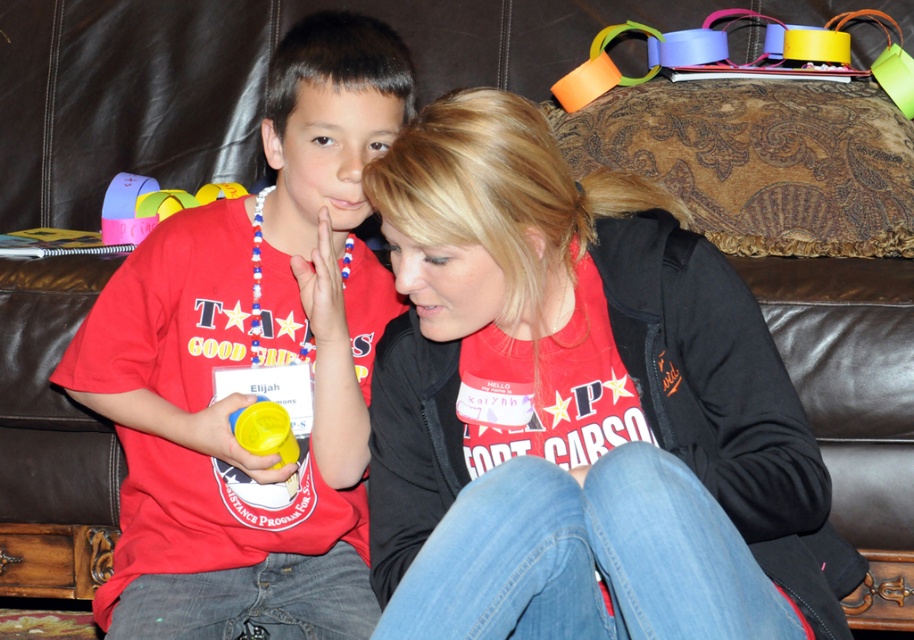
Does matte plastic cup at center appear on the left side of matte plastic cup at left?

No, matte plastic cup at center is not to the left of matte plastic cup at left.

I want to click on matte plastic cup at center, so click(x=250, y=362).

Image resolution: width=914 pixels, height=640 pixels. I want to click on matte plastic cup at center, so click(250, 362).

Is matte red shirt at center closer to the viewer compared to matte plastic cup at left?

Yes, it is in front of matte plastic cup at left.

Who is more forward, (727, 371) or (235, 189)?

Positioned in front is point (727, 371).

Image resolution: width=914 pixels, height=640 pixels. I want to click on matte red shirt at center, so click(578, 406).

Is matte red shirt at center taller than multicolored paper chain at upper right?

Yes, matte red shirt at center is taller than multicolored paper chain at upper right.

Does matte red shirt at center have a larger size compared to multicolored paper chain at upper right?

Correct, matte red shirt at center is larger in size than multicolored paper chain at upper right.

Is point (547, 189) less distant than point (811, 48)?

Yes, it is in front of point (811, 48).

The height and width of the screenshot is (640, 914). I want to click on matte red shirt at center, so click(578, 406).